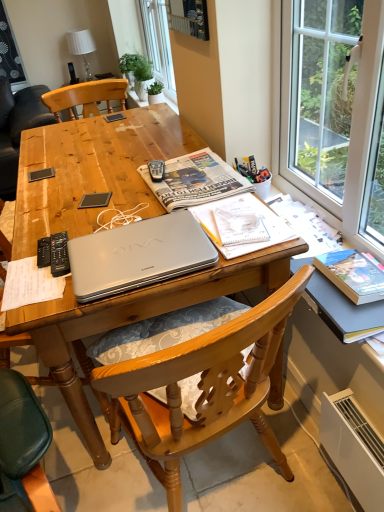
You are a GUI agent. You are given a task and a screenshot of the screen. Output one action in this format:
    pyautogui.click(x=<x>, y=<y>)
    Task: Click on the free space to the left of silver metallic laptop at center
    
    Given the screenshot: What is the action you would take?
    pyautogui.click(x=105, y=192)